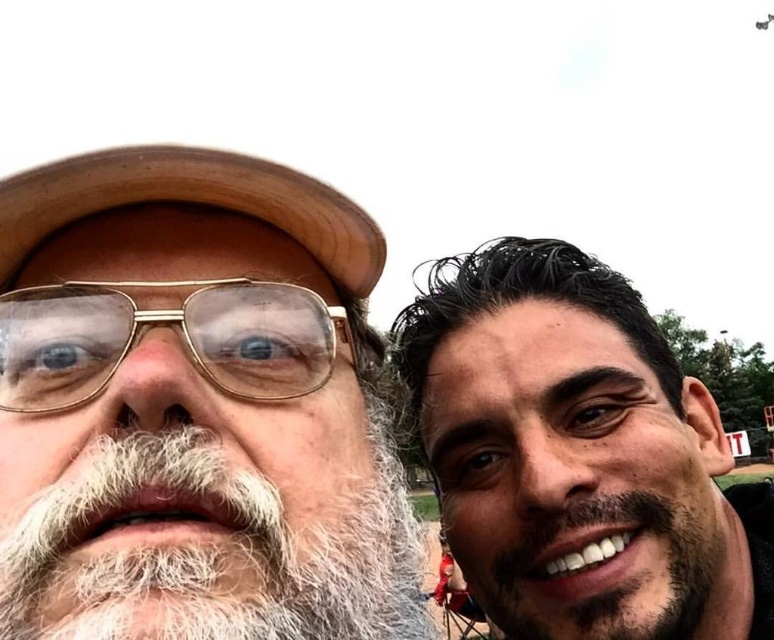
You are taking a photo of two people in an outdoor setting. You notice the white beard at left and the brown leather baseball hat at upper left. Which object is taller in the photo?

The white beard at left is taller than the brown leather baseball hat at upper left according to the description.